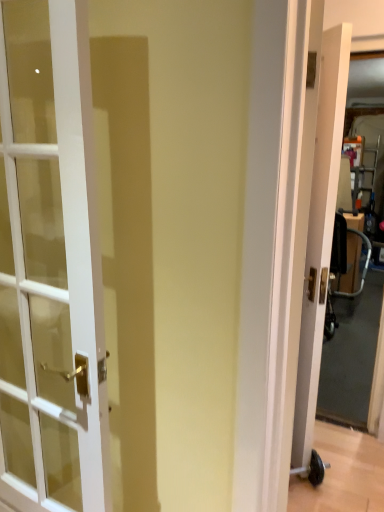
Measure the distance between metallic silver baby carriage at right and camera.

The depth of metallic silver baby carriage at right is 11.94 feet.

This screenshot has width=384, height=512. Describe the element at coordinates (320, 232) in the screenshot. I see `white wood door at right, which ranks as the second door in front-to-back order` at that location.

Image resolution: width=384 pixels, height=512 pixels. Identify the location of white glass door at left, which is the 2th door from right to left. (50, 265).

Locate an element on the screen. metallic silver baby carriage at right is located at coordinates (342, 269).

From a real-world perspective, is white glass door at left, which is the 2th door from right to left, positioned above or below white wood door at right, which ranks as the second door in front-to-back order?

Clearly, from a real-world perspective, white glass door at left, which is the 2th door from right to left, is above white wood door at right, which ranks as the second door in front-to-back order.

Considering the positions of objects white glass door at left, which is the 2th door from right to left, and white wood door at right, the 1th door viewed from the back, in the image provided, who is more to the left, white glass door at left, which is the 2th door from right to left, or white wood door at right, the 1th door viewed from the back,?

white glass door at left, which is the 2th door from right to left, is more to the left.

From the picture: Is white glass door at left, placed as the 1th door when sorted from left to right, placed right next to white wood door at right, the 1th door viewed from the back?

No, white glass door at left, placed as the 1th door when sorted from left to right, is not touching white wood door at right, the 1th door viewed from the back.

Is white glass door at left, which appears as the 1th door when viewed from the front, completely or partially outside of white wood door at right, which ranks as the second door in front-to-back order?

Yes, white glass door at left, which appears as the 1th door when viewed from the front, is not within white wood door at right, which ranks as the second door in front-to-back order.

From a real-world perspective, who is located lower, white glass door at left, placed as the 1th door when sorted from left to right, or metallic silver baby carriage at right?

metallic silver baby carriage at right, from a real-world perspective.

Would you say metallic silver baby carriage at right is part of white glass door at left, which appears as the 1th door when viewed from the front,'s contents?

No, metallic silver baby carriage at right is not inside white glass door at left, which appears as the 1th door when viewed from the front.

Considering the sizes of objects white glass door at left, which appears as the second door when viewed from the back, and metallic silver baby carriage at right in the image provided, who is shorter, white glass door at left, which appears as the second door when viewed from the back, or metallic silver baby carriage at right?

metallic silver baby carriage at right.

Which point is more distant from viewer, (338, 130) or (10, 472)?

The point (338, 130) is farther.

Where is `door located in front of the white wood door at right, which ranks as the second door in front-to-back order`? The height and width of the screenshot is (512, 384). door located in front of the white wood door at right, which ranks as the second door in front-to-back order is located at coordinates (50, 265).

Could you measure the distance between white wood door at right, which ranks as the second door in front-to-back order, and white glass door at left, which is the 2th door from right to left?

white wood door at right, which ranks as the second door in front-to-back order, is 3.58 feet away from white glass door at left, which is the 2th door from right to left.

Which object is positioned more to the right, white wood door at right, the 1th door viewed from the back, or white glass door at left, placed as the 1th door when sorted from left to right?

From the viewer's perspective, white wood door at right, the 1th door viewed from the back, appears more on the right side.

Does white wood door at right, which ranks as the second door in front-to-back order, have a larger size compared to metallic silver baby carriage at right?

No.

Does white wood door at right, the 2th door from the left, appear on the left side of metallic silver baby carriage at right?

Yes.

Between white wood door at right, which ranks as the second door in front-to-back order, and metallic silver baby carriage at right, which one has less height?

Standing shorter between the two is metallic silver baby carriage at right.

The width and height of the screenshot is (384, 512). What are the coordinates of `door that is the 2nd object above the metallic silver baby carriage at right (from a real-world perspective)` in the screenshot? It's located at (50, 265).

Is metallic silver baby carriage at right outside of white glass door at left, which appears as the second door when viewed from the back?

metallic silver baby carriage at right is positioned outside white glass door at left, which appears as the second door when viewed from the back.

Consider the image. Who is smaller, metallic silver baby carriage at right or white wood door at right, acting as the 1th door starting from the right?

Smaller between the two is white wood door at right, acting as the 1th door starting from the right.

Is metallic silver baby carriage at right with white wood door at right, the 1th door viewed from the back?

They are not placed beside each other.

Is metallic silver baby carriage at right facing towards white wood door at right, acting as the 1th door starting from the right?

No, metallic silver baby carriage at right is not oriented towards white wood door at right, acting as the 1th door starting from the right.

At what (x,y) coordinates should I click in order to perform the action: click on door below the white wood door at right, acting as the 1th door starting from the right (from the image's perspective). Please return your answer as a coordinate pair (x, y). Looking at the image, I should click on click(50, 265).

At what (x,y) coordinates should I click in order to perform the action: click on baby carriage on the right of white glass door at left, which is the 2th door from right to left. Please return your answer as a coordinate pair (x, y). The height and width of the screenshot is (512, 384). Looking at the image, I should click on (342, 269).

Which object lies nearer to the anchor point metallic silver baby carriage at right, white glass door at left, which is the 2th door from right to left, or white wood door at right, which ranks as the second door in front-to-back order?

white wood door at right, which ranks as the second door in front-to-back order, is closer to metallic silver baby carriage at right.

Estimate the real-world distances between objects in this image. Which object is further from white glass door at left, which appears as the 1th door when viewed from the front, metallic silver baby carriage at right or white wood door at right, the 1th door viewed from the back?

The object further to white glass door at left, which appears as the 1th door when viewed from the front, is metallic silver baby carriage at right.

Estimate the real-world distances between objects in this image. Which object is closer to white glass door at left, which appears as the second door when viewed from the back, white wood door at right, acting as the 1th door starting from the right, or metallic silver baby carriage at right?

white wood door at right, acting as the 1th door starting from the right.

From the image, which object appears to be nearer to metallic silver baby carriage at right, white wood door at right, the 1th door viewed from the back, or white glass door at left, which is the 2th door from right to left?

The object closer to metallic silver baby carriage at right is white wood door at right, the 1th door viewed from the back.

Estimate the real-world distances between objects in this image. Which object is further from white wood door at right, the 1th door viewed from the back, metallic silver baby carriage at right or white glass door at left, which appears as the 1th door when viewed from the front?

The object further to white wood door at right, the 1th door viewed from the back, is metallic silver baby carriage at right.

Considering their positions, is white glass door at left, placed as the 1th door when sorted from left to right, positioned further to white wood door at right, which ranks as the second door in front-to-back order, than metallic silver baby carriage at right?

Among the two, metallic silver baby carriage at right is located further to white wood door at right, which ranks as the second door in front-to-back order.

The height and width of the screenshot is (512, 384). I want to click on door between white glass door at left, which appears as the second door when viewed from the back, and metallic silver baby carriage at right in the front-back direction, so click(x=320, y=232).